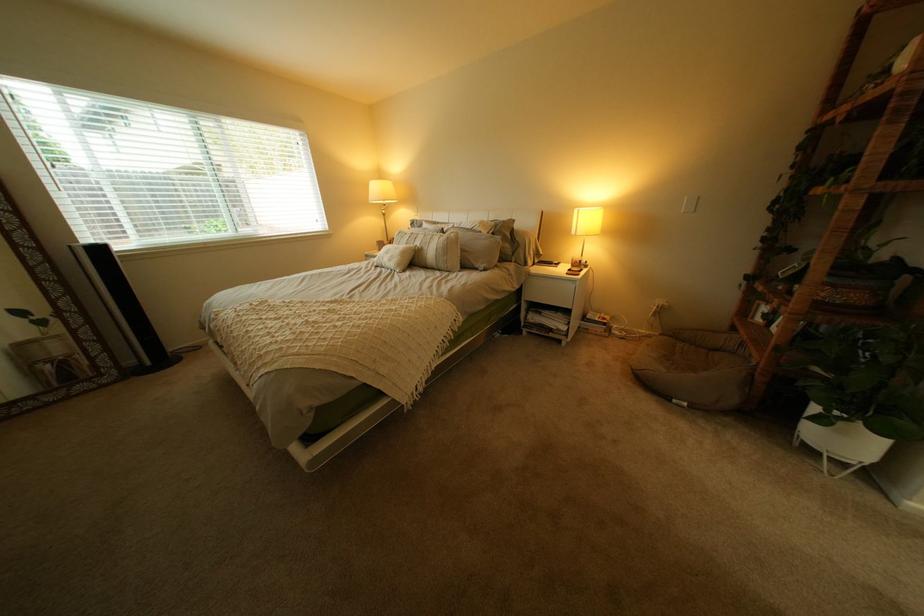
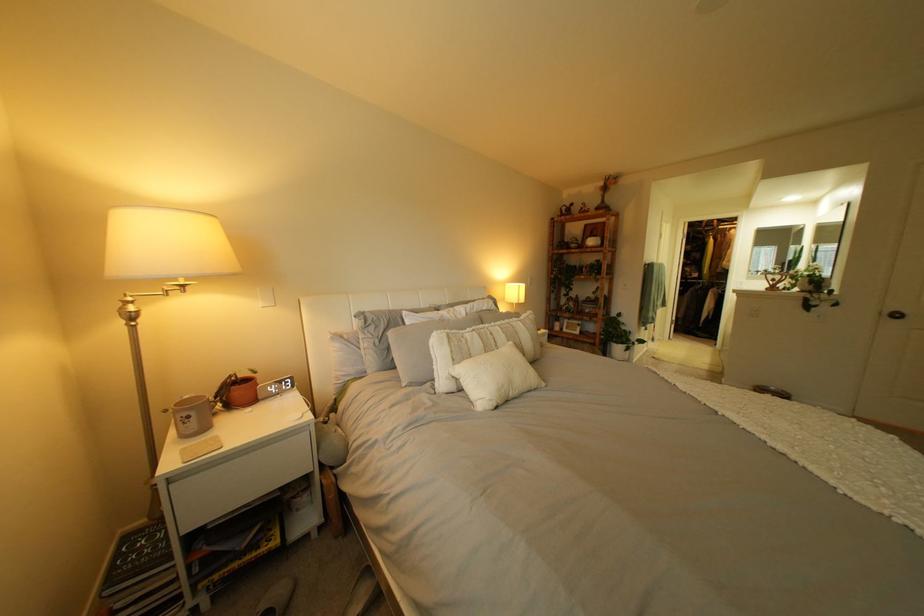
Find the pixel in the second image that matches point 435,243 in the first image.

(518, 337)